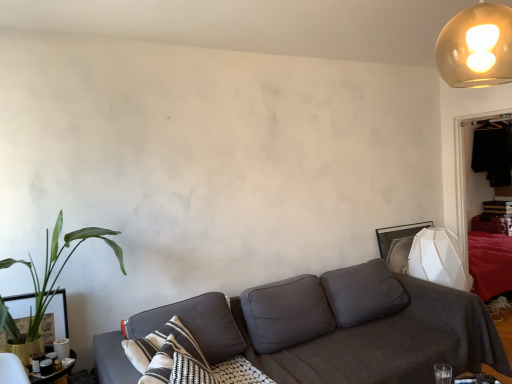
The width and height of the screenshot is (512, 384). What do you see at coordinates (54, 372) in the screenshot?
I see `wooden textured table at lower left` at bounding box center [54, 372].

Locate an element on the screen. The width and height of the screenshot is (512, 384). white matte geometric lampshade at right is located at coordinates (437, 258).

The width and height of the screenshot is (512, 384). What do you see at coordinates (342, 334) in the screenshot?
I see `dark gray fabric couch at center` at bounding box center [342, 334].

Describe the element at coordinates (464, 179) in the screenshot. Image resolution: width=512 pixels, height=384 pixels. I see `dark brown wooden dresser at right` at that location.

Measure the distance between point (x=468, y=43) and camera.

Point (x=468, y=43) is 4.70 feet away from camera.

Where is `translucent glass globe at upper right`? translucent glass globe at upper right is located at coordinates (476, 47).

At what (x,y) coordinates should I click in order to perform the action: click on dark gray fabric pillow at center. Please return your answer as a coordinate pair (x, y). Image resolution: width=512 pixels, height=384 pixels. Looking at the image, I should click on (196, 325).

Considering the relative sizes of green leafy plant at left and translucent glass globe at upper right in the image provided, is green leafy plant at left bigger than translucent glass globe at upper right?

Yes, green leafy plant at left is bigger than translucent glass globe at upper right.

Does green leafy plant at left have a greater height compared to translucent glass globe at upper right?

Yes, green leafy plant at left is taller than translucent glass globe at upper right.

Looking at this image, can you confirm if green leafy plant at left is positioned to the right of translucent glass globe at upper right?

No.

In terms of width, does green leafy plant at left look wider or thinner when compared to translucent glass globe at upper right?

green leafy plant at left is wider than translucent glass globe at upper right.

Is dark gray fabric pillow at center taller than green leafy plant at left?

Incorrect, the height of dark gray fabric pillow at center is not larger of that of green leafy plant at left.

Is dark gray fabric pillow at center smaller than green leafy plant at left?

Yes, dark gray fabric pillow at center is smaller than green leafy plant at left.

How different are the orientations of dark gray fabric pillow at center and green leafy plant at left in degrees?

The angular difference between dark gray fabric pillow at center and green leafy plant at left is 58.3 degrees.

Which is behind, point (132, 334) or point (23, 339)?

The point (23, 339) is farther from the camera.

Is white matte geometric lampshade at right looking in the opposite direction of green leafy plant at left?

No.

Consider the image. Can you confirm if white matte geometric lampshade at right is positioned to the right of green leafy plant at left?

Yes.

In the scene shown: From the image's perspective, which is below, white matte geometric lampshade at right or green leafy plant at left?

white matte geometric lampshade at right is shown below in the image.

Who is more distant, white matte geometric lampshade at right or green leafy plant at left?

white matte geometric lampshade at right is behind.

From the image's perspective, is translucent glass globe at upper right on top of white matte geometric lampshade at right?

Indeed, from the image's perspective, translucent glass globe at upper right is shown above white matte geometric lampshade at right.

Which of these two, translucent glass globe at upper right or white matte geometric lampshade at right, is smaller?

translucent glass globe at upper right is smaller.

Are translucent glass globe at upper right and white matte geometric lampshade at right located far from each other?

That's right, there is a large distance between translucent glass globe at upper right and white matte geometric lampshade at right.

At what (x,y) coordinates should I click in order to perform the action: click on lamp lying in front of the white matte geometric lampshade at right. Please return your answer as a coordinate pair (x, y). The width and height of the screenshot is (512, 384). Looking at the image, I should click on (476, 47).

Can you confirm if white matte geometric lampshade at right is thinner than dark gray fabric pillow at center?

Incorrect, the width of white matte geometric lampshade at right is not less than that of dark gray fabric pillow at center.

What's the angular difference between white matte geometric lampshade at right and dark gray fabric pillow at center's facing directions?

There is a 60.2-degree angle between the facing directions of white matte geometric lampshade at right and dark gray fabric pillow at center.

Can you see white matte geometric lampshade at right touching dark gray fabric pillow at center?

No.

Considering the positions of objects white matte geometric lampshade at right and dark gray fabric pillow at center in the image provided, who is more to the left, white matte geometric lampshade at right or dark gray fabric pillow at center?

dark gray fabric pillow at center.

Which of these two, translucent glass globe at upper right or wooden textured table at lower left, is thinner?

Thinner between the two is translucent glass globe at upper right.

Can you tell me how much translucent glass globe at upper right and wooden textured table at lower left differ in facing direction?

They differ by 0.672 degrees in their facing directions.

Is translucent glass globe at upper right next to wooden textured table at lower left and touching it?

No, translucent glass globe at upper right is not beside wooden textured table at lower left.

Is point (475, 8) less distant than point (64, 367)?

Yes, point (475, 8) is closer to viewer.

Is dark gray fabric pillow at center inside or outside of translucent glass globe at upper right?

dark gray fabric pillow at center lies outside translucent glass globe at upper right.

Based on the photo, from a real-world perspective, between dark gray fabric pillow at center and translucent glass globe at upper right, who is vertically lower?

dark gray fabric pillow at center is physically lower.

Would you say dark gray fabric pillow at center is a long distance from translucent glass globe at upper right?

That's right, there is a large distance between dark gray fabric pillow at center and translucent glass globe at upper right.

Find the location of a particular element. This screenshot has height=384, width=512. houseplant on the left of the translucent glass globe at upper right is located at coordinates (50, 276).

Locate an element on the screen. This screenshot has height=384, width=512. pillow on the right of green leafy plant at left is located at coordinates (196, 325).

Looking at the image, which one is located closer to dark brown wooden dresser at right, dark gray fabric couch at center or dark gray fabric pillow at center?

dark gray fabric couch at center.

Estimate the real-world distances between objects in this image. Which object is closer to dark gray fabric pillow at center, white matte geometric lampshade at right or dark brown wooden dresser at right?

white matte geometric lampshade at right.

Considering their positions, is green leafy plant at left positioned further to dark gray fabric couch at center than wooden textured table at lower left?

Among the two, wooden textured table at lower left is located further to dark gray fabric couch at center.

When comparing their distances from white matte geometric lampshade at right, does wooden textured table at lower left or dark brown wooden dresser at right seem further?

Among the two, wooden textured table at lower left is located further to white matte geometric lampshade at right.

Looking at the image, which one is located closer to translucent glass globe at upper right, wooden textured table at lower left or dark brown wooden dresser at right?

dark brown wooden dresser at right lies closer to translucent glass globe at upper right than the other object.

Looking at the image, which one is located closer to wooden textured table at lower left, translucent glass globe at upper right or green leafy plant at left?

green leafy plant at left.

Based on their spatial positions, is dark gray fabric pillow at center or white matte geometric lampshade at right closer to wooden textured table at lower left?

dark gray fabric pillow at center is positioned closer to the anchor wooden textured table at lower left.

Based on their spatial positions, is white matte geometric lampshade at right or green leafy plant at left further from translucent glass globe at upper right?

Among the two, green leafy plant at left is located further to translucent glass globe at upper right.

Image resolution: width=512 pixels, height=384 pixels. What are the coordinates of `pillow between green leafy plant at left and dark gray fabric couch at center from left to right` in the screenshot? It's located at (196, 325).

Find the location of a particular element. The width and height of the screenshot is (512, 384). studio couch between green leafy plant at left and dark brown wooden dresser at right in the horizontal direction is located at coordinates (342, 334).

Where is `table lamp positioned between translucent glass globe at upper right and dark brown wooden dresser at right from near to far`? This screenshot has width=512, height=384. table lamp positioned between translucent glass globe at upper right and dark brown wooden dresser at right from near to far is located at coordinates (437, 258).

Locate an element on the screen. This screenshot has width=512, height=384. pillow situated between wooden textured table at lower left and dark brown wooden dresser at right from left to right is located at coordinates (196, 325).